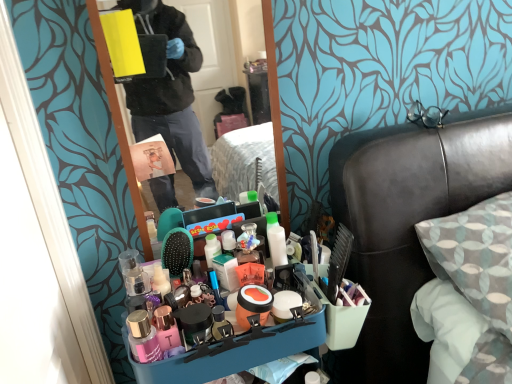
Identify the location of vacant region above blue plastic tray at center (from a real-world perspective). (229, 300).